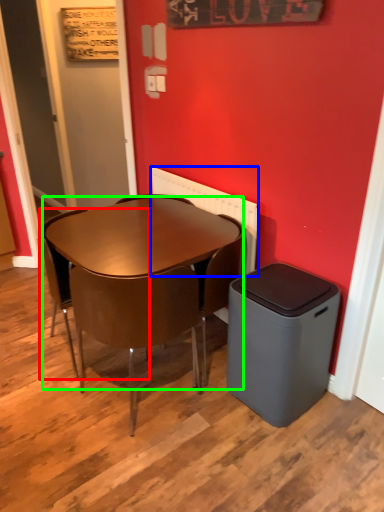
Question: Which object is the farthest from chair (highlighted by a red box)? Choose among these: radiator (highlighted by a blue box) or desk (highlighted by a green box).

Choices:
 (A) radiator
 (B) desk

Answer: (A)